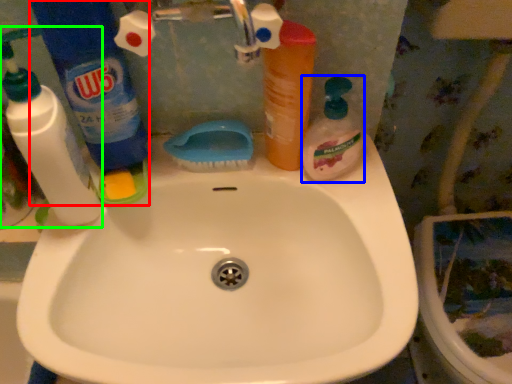
Question: Considering the real-world distances, which object is closest to cleaning product (highlighted by a red box)? cleaning product (highlighted by a blue box) or cleaning product (highlighted by a green box).

Choices:
 (A) cleaning product
 (B) cleaning product

Answer: (B)